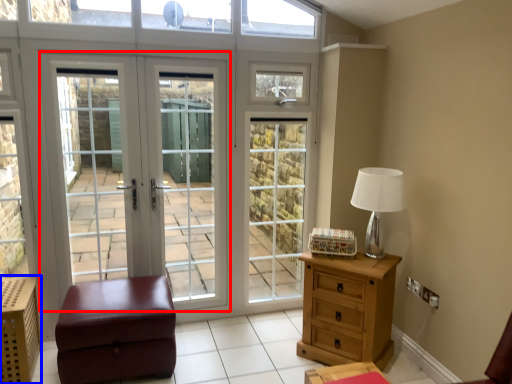
Question: Which point is closer to the camera, door (highlighted by a red box) or crate (highlighted by a blue box)?

Choices:
 (A) door
 (B) crate

Answer: (B)